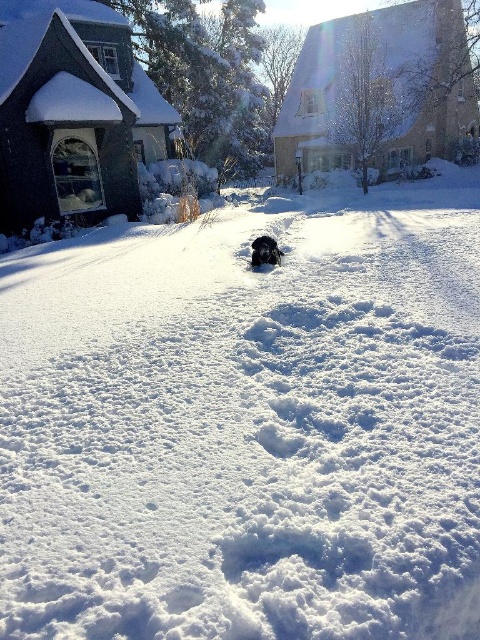
Is white fluffy snow at center positioned behind black fur dog at center?

No, white fluffy snow at center is in front of black fur dog at center.

Does point (95, 580) come closer to viewer compared to point (267, 256)?

Yes.

Which is behind, point (400, 212) or point (268, 256)?

Positioned behind is point (400, 212).

This screenshot has width=480, height=640. I want to click on white fluffy snow at center, so click(247, 422).